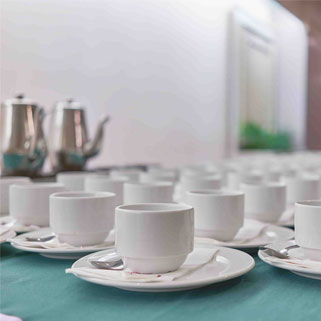
You are a GUI agent. You are given a task and a screenshot of the screen. Output one action in this format:
    pyautogui.click(x=<x>, y=<y>)
    Task: Click on the window
    This screenshot has width=321, height=321.
    Given the screenshot: What is the action you would take?
    pyautogui.click(x=261, y=83)